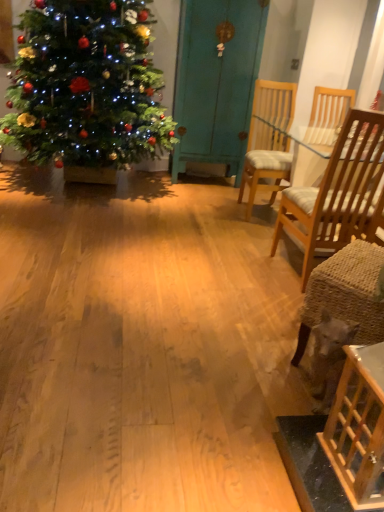
Question: Would you say light brown wood chair at right, which is the first chair from front to back, is inside or outside shiny green christmas tree at left?

Choices:
 (A) outside
 (B) inside

Answer: (A)

Question: In terms of width, does light brown wood chair at right, which is the first chair from front to back, look wider or thinner when compared to shiny green christmas tree at left?

Choices:
 (A) thin
 (B) wide

Answer: (A)

Question: Which is nearer to the teal painted wood armoire at center?

Choices:
 (A) shiny green christmas tree at left
 (B) light brown wood chair at right, which is the first chair from front to back
 (C) wooden table at lower right
 (D) wooden chair with cushion at center, marked as the second chair in a front-to-back arrangement

Answer: (A)

Question: Which of these objects is positioned closest to the light brown wood chair at right, positioned as the 2th chair in back-to-front order?

Choices:
 (A) teal painted wood armoire at center
 (B) shiny green christmas tree at left
 (C) wooden table at lower right
 (D) wooden chair with cushion at center, marked as the second chair in a front-to-back arrangement

Answer: (D)